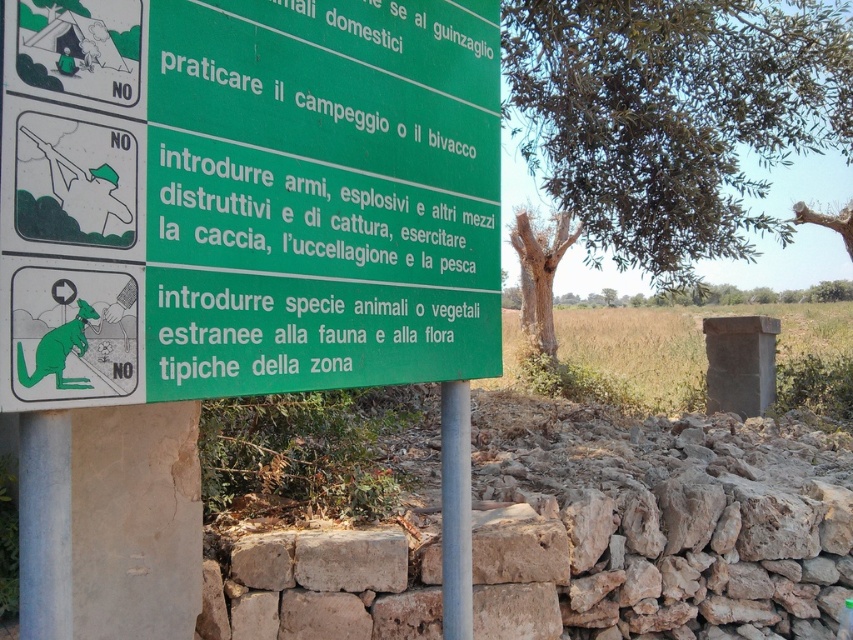
Locate an element on the screen. This screenshot has width=853, height=640. green leafy tree at upper center is located at coordinates (672, 116).

Is the position of green leafy tree at upper center less distant than that of brown textured tree at upper right?

That is True.

This screenshot has width=853, height=640. Identify the location of green leafy tree at upper center. (672, 116).

Who is more forward, (450, 540) or (548, 349)?

Point (450, 540)

Does point (453, 461) lie behind point (527, 221)?

No, it is in front of (527, 221).

Which is in front, point (445, 483) or point (520, 288)?

Positioned in front is point (445, 483).

Locate an element on the screen. Image resolution: width=853 pixels, height=640 pixels. gray metallic pole at center is located at coordinates (456, 509).

Is green leafy tree at upper center thinner than gray metallic pole at center?

No, green leafy tree at upper center is not thinner than gray metallic pole at center.

Which is above, green leafy tree at upper center or gray metallic pole at center?

green leafy tree at upper center is above.

Identify the location of green leafy tree at upper center. This screenshot has width=853, height=640. (672, 116).

Where is `green leafy tree at upper center`? green leafy tree at upper center is located at coordinates (672, 116).